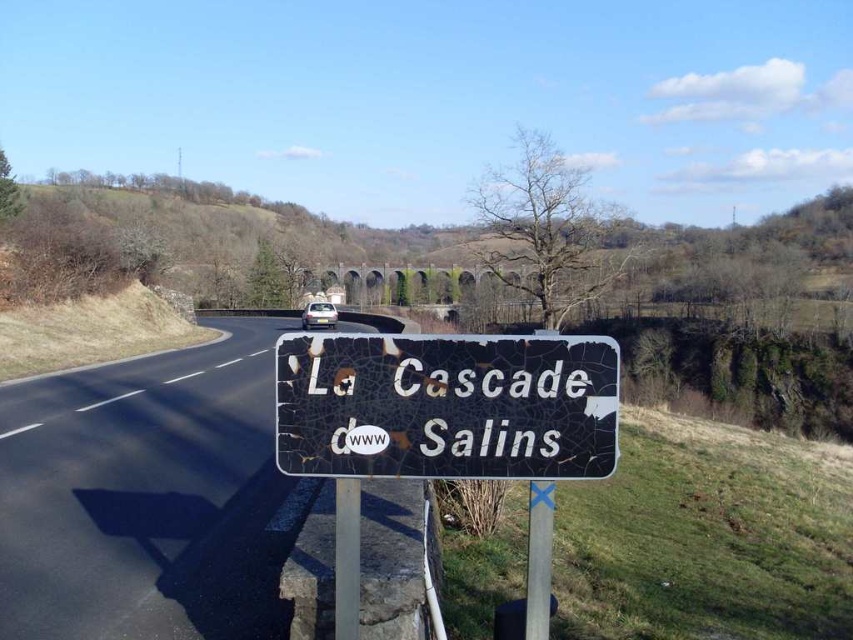
You are standing at the point labeled point (445, 426) in the image. What object is directly in front of you?

The cracked paint sign at center is directly in front of you at point (445, 426).

You are a hiker who wants to read the signs along the road. Which sign, the cracked paint sign at center or the cracked metal sign at lower center, is taller?

The cracked paint sign at center is taller than the cracked metal sign at lower center.

You are a driver approaching the stone bridge and need to stay on the black asphalt road at center. Can you see the cracked paint sign at center clearly from the road?

The black asphalt road at center is larger in size than cracked paint sign at center, so the cracked paint sign at center might be harder to see from the road due to its smaller size.